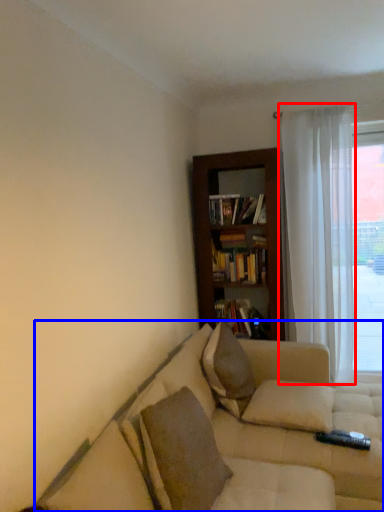
Question: Which point is further to the camera, curtain (highlighted by a red box) or studio couch (highlighted by a blue box)?

Choices:
 (A) curtain
 (B) studio couch

Answer: (A)